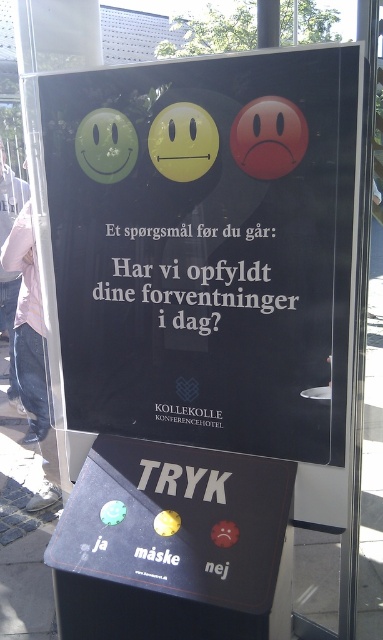
Is black glossy poster at center closer to camera compared to rubberized plastic buttons at center?

Yes, black glossy poster at center is in front of rubberized plastic buttons at center.

Is black glossy poster at center to the left of rubberized plastic buttons at center from the viewer's perspective?

Incorrect, black glossy poster at center is not on the left side of rubberized plastic buttons at center.

The width and height of the screenshot is (383, 640). What do you see at coordinates (206, 248) in the screenshot? I see `black glossy poster at center` at bounding box center [206, 248].

Identify the location of black glossy poster at center. point(206,248).